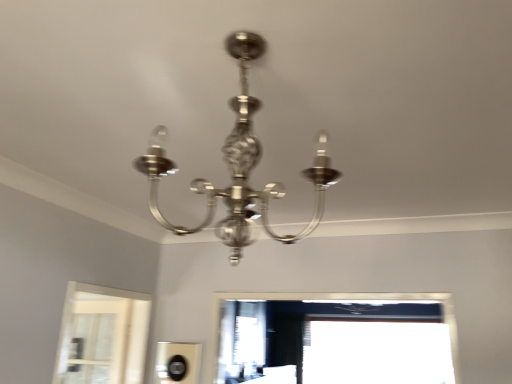
Question: Is transparent glass window at lower right wider or thinner than polished silver chandelier at center?

Choices:
 (A) thin
 (B) wide

Answer: (A)

Question: From the image's perspective, is transparent glass window at lower right above or below polished silver chandelier at center?

Choices:
 (A) below
 (B) above

Answer: (A)

Question: From a real-world perspective, is transparent glass window at lower right above or below polished silver chandelier at center?

Choices:
 (A) above
 (B) below

Answer: (B)

Question: Considering the positions of polished silver chandelier at center and transparent glass window at lower right in the image, is polished silver chandelier at center wider or thinner than transparent glass window at lower right?

Choices:
 (A) thin
 (B) wide

Answer: (B)

Question: Does point (238, 132) appear closer or farther from the camera than point (322, 357)?

Choices:
 (A) farther
 (B) closer

Answer: (B)

Question: Is polished silver chandelier at center taller or shorter than transparent glass window at lower right?

Choices:
 (A) short
 (B) tall

Answer: (A)

Question: Considering the relative positions of polished silver chandelier at center and transparent glass window at lower right in the image provided, is polished silver chandelier at center to the left or to the right of transparent glass window at lower right?

Choices:
 (A) right
 (B) left

Answer: (B)